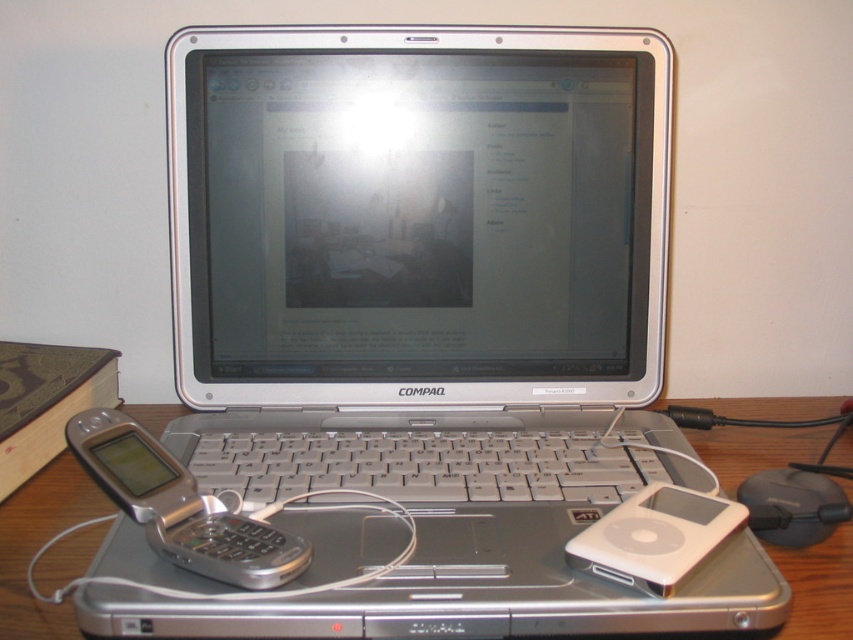
Which is below, wooden table at lower center or black plastic mouse at lower right?

Positioned lower is wooden table at lower center.

Describe the element at coordinates (39, 545) in the screenshot. I see `wooden table at lower center` at that location.

The height and width of the screenshot is (640, 853). I want to click on wooden table at lower center, so click(x=39, y=545).

Between silver metallic phone at lower left and black plastic mouse at lower right, which one appears on the right side from the viewer's perspective?

Positioned to the right is black plastic mouse at lower right.

Does silver metallic phone at lower left have a greater width compared to black plastic mouse at lower right?

Correct, the width of silver metallic phone at lower left exceeds that of black plastic mouse at lower right.

This screenshot has width=853, height=640. Identify the location of silver metallic phone at lower left. (181, 506).

Who is more distant from viewer, (198, 547) or (704, 545)?

The point (704, 545) is more distant.

Who is higher up, silver metallic phone at lower left or white plastic ipod at lower right?

Positioned higher is silver metallic phone at lower left.

The height and width of the screenshot is (640, 853). Describe the element at coordinates (181, 506) in the screenshot. I see `silver metallic phone at lower left` at that location.

The image size is (853, 640). In order to click on silver metallic phone at lower left in this screenshot , I will do `click(181, 506)`.